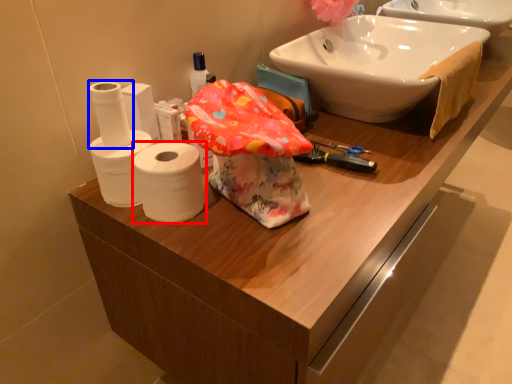
Question: Which object is further to the camera taking this photo, toilet paper (highlighted by a red box) or toilet paper (highlighted by a blue box)?

Choices:
 (A) toilet paper
 (B) toilet paper

Answer: (B)